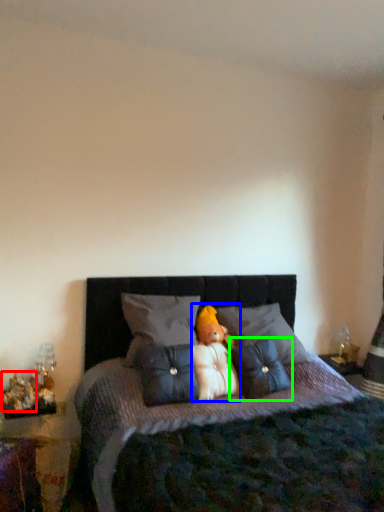
Question: Estimate the real-world distances between objects in this image. Which object is closer to toy (highlighted by a red box), doll (highlighted by a blue box) or pillow (highlighted by a green box)?

Choices:
 (A) doll
 (B) pillow

Answer: (A)